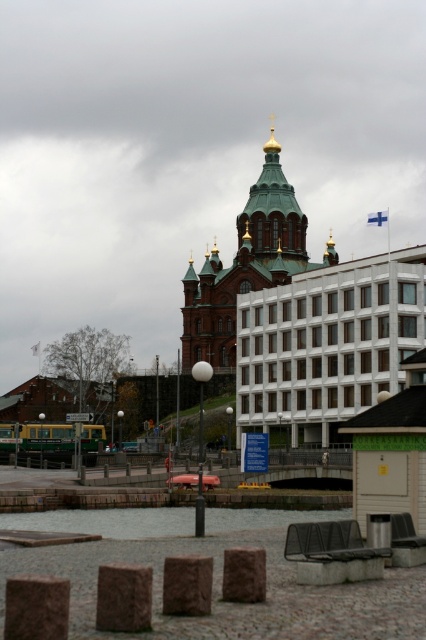
You are standing in front of the church and looking at the modern white building. Where is the green metallic dome at center located relative to the modern white building?

The green metallic dome at center is located at the center of the church, which is behind the modern white building.

You are standing in front of the church and want to take a photo that includes both the green metallic dome at center and the clear water at lower center. Which object should you position closer to the front of your camera frame to ensure both are in focus?

You should position the green metallic dome at center closer to the front of your camera frame because it is closer to you than the clear water at lower center, ensuring both are in focus.

You are standing at the edge of a pond and see the green metallic dome at center and the clear water at lower center. Which object is higher in elevation?

The green metallic dome at center is above clear water at lower center, so it is higher in elevation.